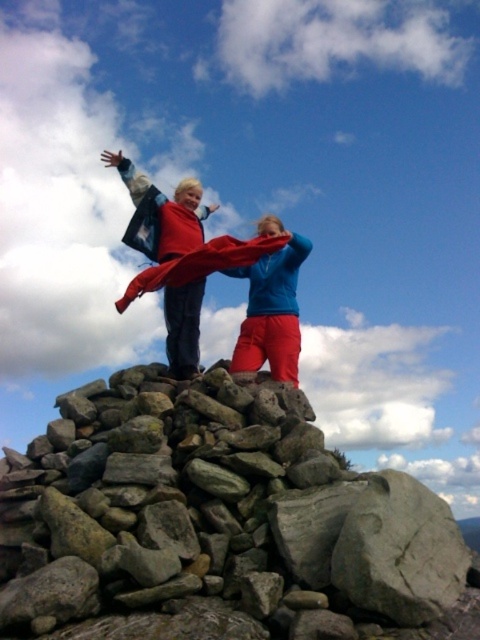
Question: Is gray rock pile at center positioned at the back of matte red scarf at center?

Choices:
 (A) yes
 (B) no

Answer: (B)

Question: Among these objects, which one is farthest from the camera?

Choices:
 (A) matte red scarf at center
 (B) gray rock pile at center

Answer: (A)

Question: Which point appears closest to the camera in this image?

Choices:
 (A) (149, 497)
 (B) (248, 262)
 (C) (236, 276)

Answer: (A)

Question: Is matte red scarf at center thinner than matte blue jacket at center?

Choices:
 (A) yes
 (B) no

Answer: (B)

Question: From the image, what is the correct spatial relationship of matte red scarf at center in relation to matte blue jacket at center?

Choices:
 (A) right
 (B) left

Answer: (B)

Question: Which point is farther to the camera?

Choices:
 (A) matte blue jacket at center
 (B) gray rock pile at center
 (C) matte red scarf at center

Answer: (A)